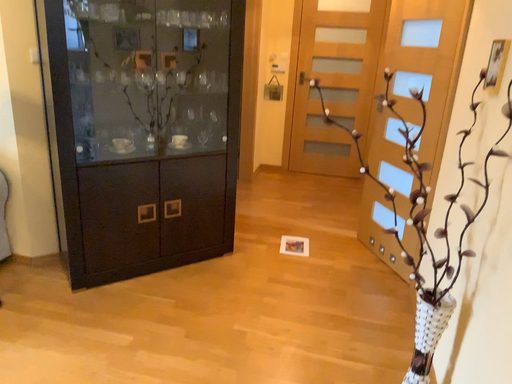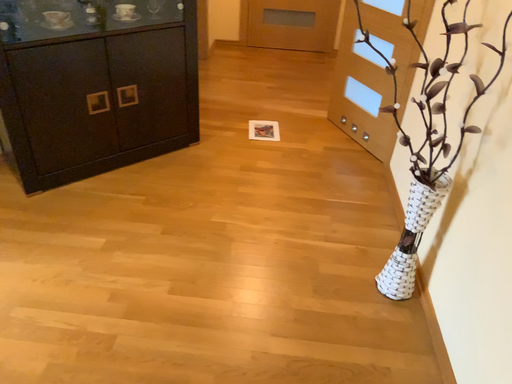
Question: Which way did the camera rotate in the video?

Choices:
 (A) rotated downward
 (B) rotated upward

Answer: (A)